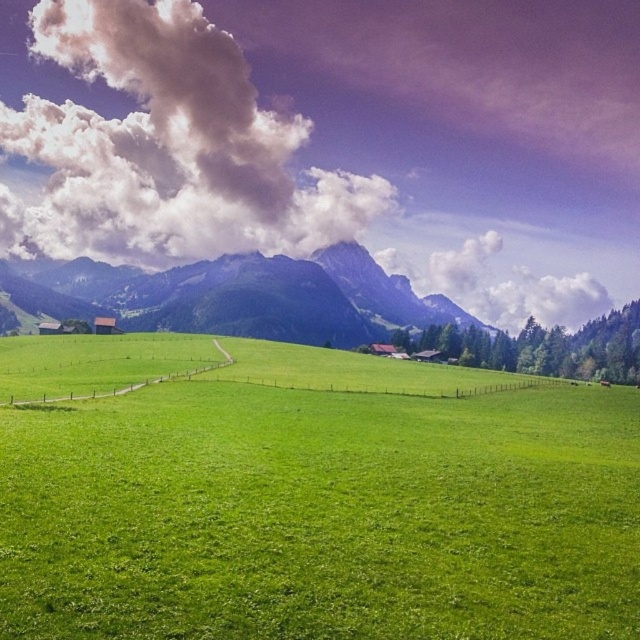
Question: Does green grassy field at center have a larger size compared to white fluffy cloud at upper center?

Choices:
 (A) yes
 (B) no

Answer: (B)

Question: Among these objects, which one is nearest to the camera?

Choices:
 (A) white fluffy cloud at upper center
 (B) green grassy field at center

Answer: (B)

Question: Which of the following is the closest to the observer?

Choices:
 (A) green grassy field at center
 (B) white fluffy cloud at upper center

Answer: (A)

Question: Does green grassy field at center have a greater width compared to white fluffy cloud at upper center?

Choices:
 (A) yes
 (B) no

Answer: (B)

Question: Does green grassy field at center appear on the right side of white fluffy cloud at upper center?

Choices:
 (A) no
 (B) yes

Answer: (B)